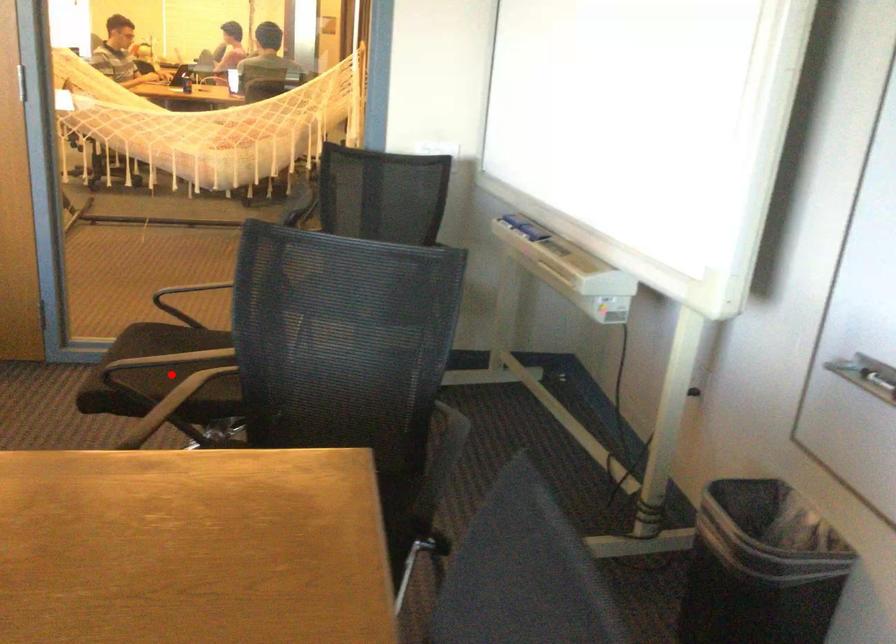
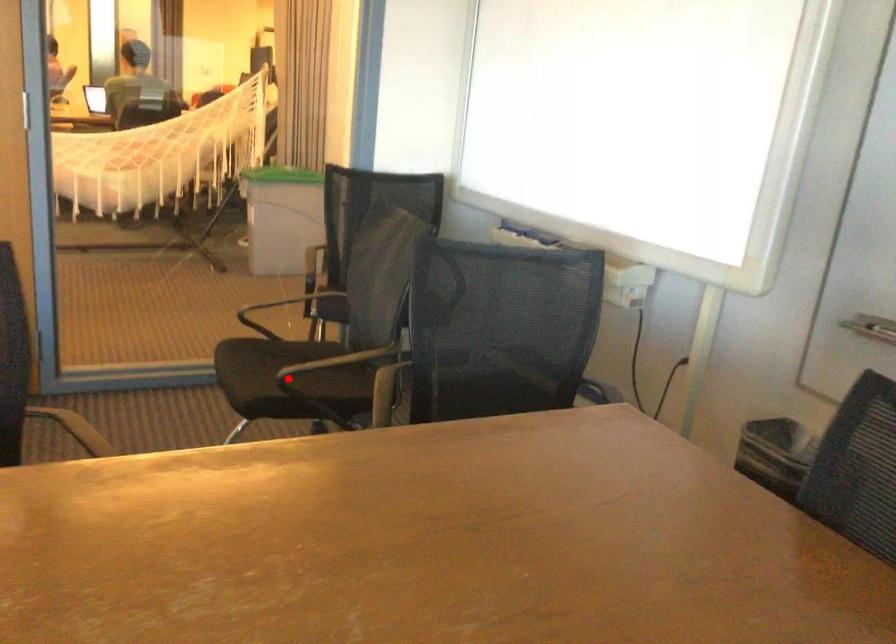
I am providing you with two images of the same scene from different viewpoints. A red point is marked on the first image and another point is marked on the second image. Are the points marked in image1 and image2 representing the same 3D position?

Yes